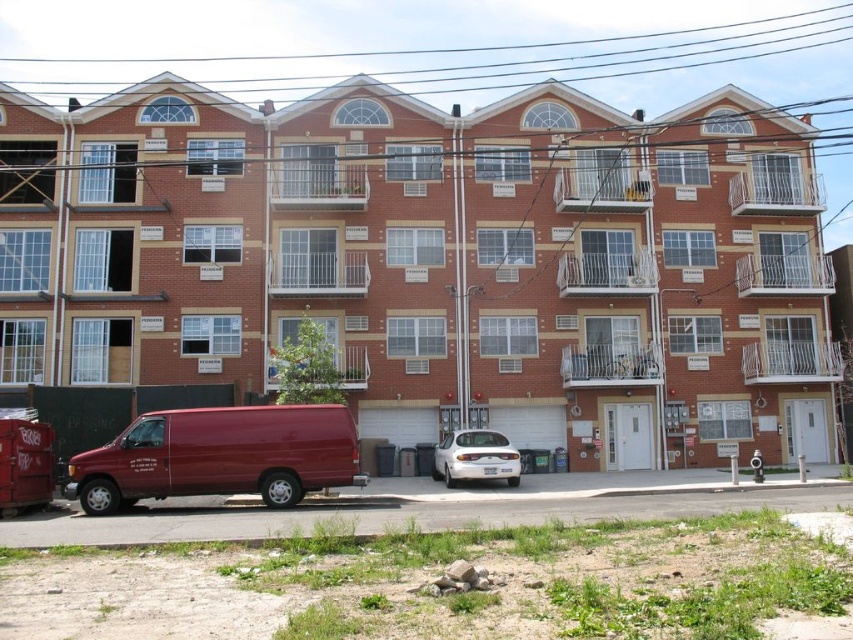
Question: Can you confirm if matte red van at lower left is wider than white glossy sedan at center?

Choices:
 (A) yes
 (B) no

Answer: (B)

Question: Which object appears closest to the camera in this image?

Choices:
 (A) black wire at upper center
 (B) white glossy sedan at center

Answer: (B)

Question: Considering the real-world distances, which object is farthest from the white glossy sedan at center?

Choices:
 (A) black wire at upper center
 (B) matte red van at lower left

Answer: (A)

Question: Is black wire at upper center to the right of matte red van at lower left from the viewer's perspective?

Choices:
 (A) no
 (B) yes

Answer: (B)

Question: Estimate the real-world distances between objects in this image. Which object is closer to the black wire at upper center?

Choices:
 (A) matte red van at lower left
 (B) white glossy sedan at center

Answer: (B)

Question: Is black wire at upper center behind matte red van at lower left?

Choices:
 (A) yes
 (B) no

Answer: (A)